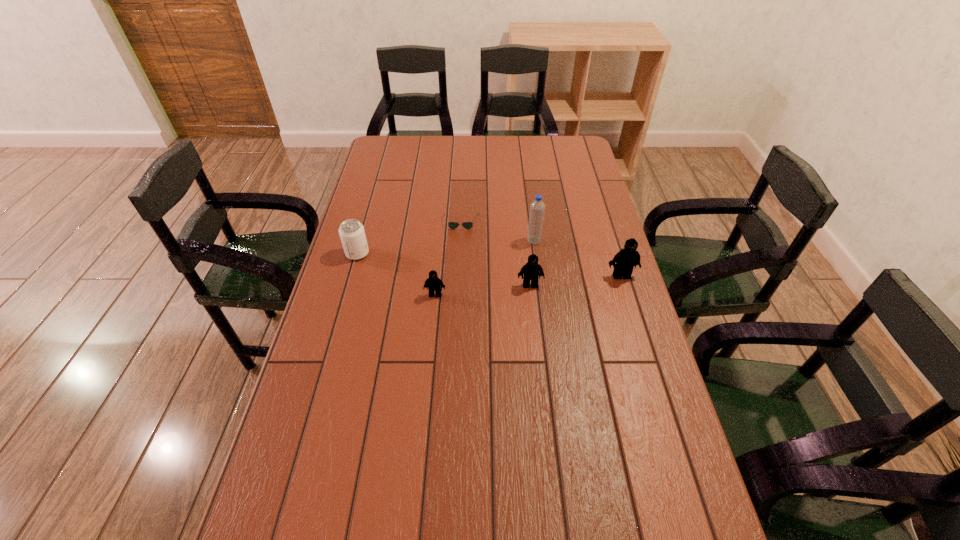
Identify the location of vacant space at the far edge. click(434, 150).

Locate an element on the screen. Image resolution: width=960 pixels, height=540 pixels. vacant area at the left edge is located at coordinates (369, 280).

I want to click on vacant space at the right edge, so click(x=615, y=408).

In order to click on free region at the far left corner of the desktop in this screenshot , I will do `click(390, 158)`.

The width and height of the screenshot is (960, 540). In the image, there is a desktop. In order to click on free space at the far right corner in this screenshot , I will do `click(552, 153)`.

This screenshot has height=540, width=960. In order to click on vacant point located between the second shortest Lego and the fifth tallest object in this screenshot , I will do `click(483, 290)`.

Where is `unoccupied area between the shortest object and the water bottle`? unoccupied area between the shortest object and the water bottle is located at coordinates tap(497, 232).

Where is `vacant space that is in between the nearest object and the farthest object`? vacant space that is in between the nearest object and the farthest object is located at coordinates (448, 259).

The width and height of the screenshot is (960, 540). What are the coordinates of `free space between the leftmost object and the water bottle` in the screenshot? It's located at (445, 247).

At what (x,y) coordinates should I click in order to perform the action: click on vacant space that's between the leftmost object and the tallest object. Please return your answer as a coordinate pair (x, y). This screenshot has width=960, height=540. Looking at the image, I should click on (445, 247).